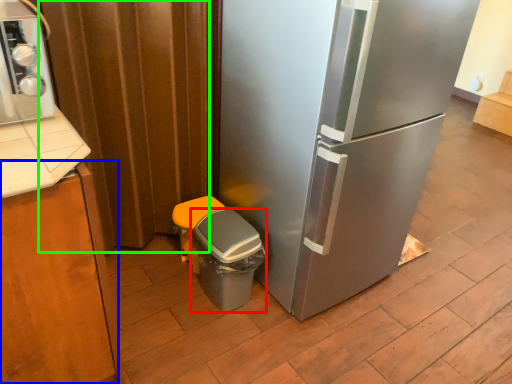
Question: Estimate the real-world distances between objects in this image. Which object is farther from potty (highlighted by a red box), cabinetry (highlighted by a blue box) or curtain (highlighted by a green box)?

Choices:
 (A) cabinetry
 (B) curtain

Answer: (A)